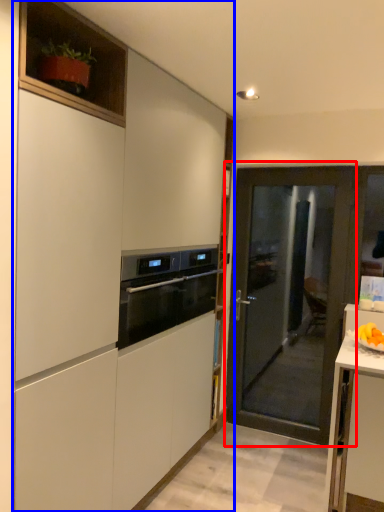
Question: Which point is closer to the camera, door (highlighted by a red box) or cabinetry (highlighted by a blue box)?

Choices:
 (A) door
 (B) cabinetry

Answer: (B)